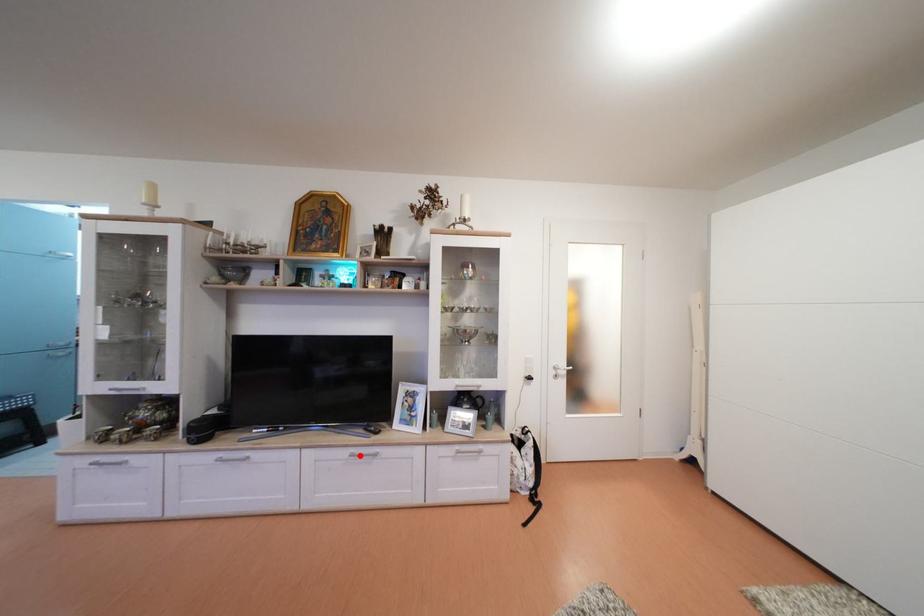
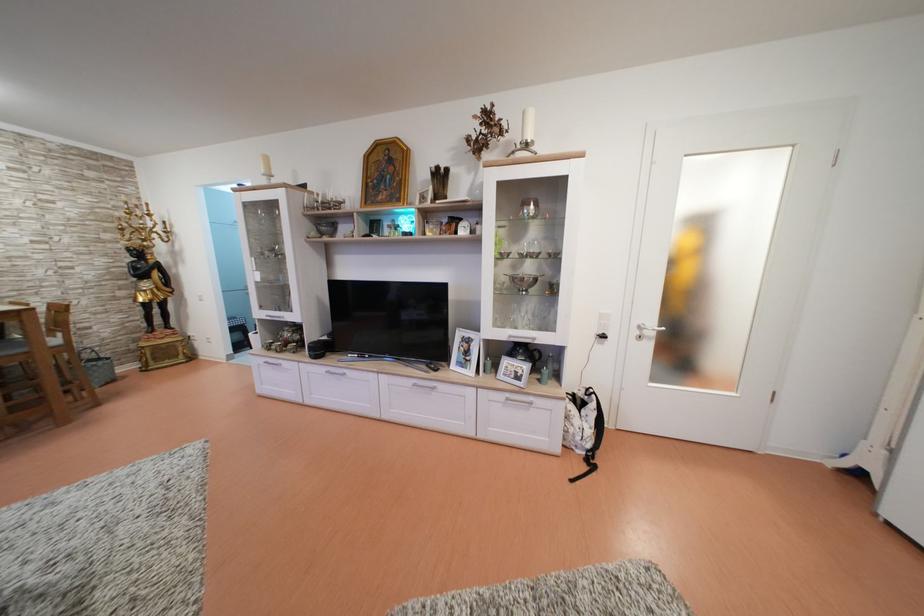
The point at the highlighted location is marked in the first image. Where is the corresponding point in the second image?

(422, 387)